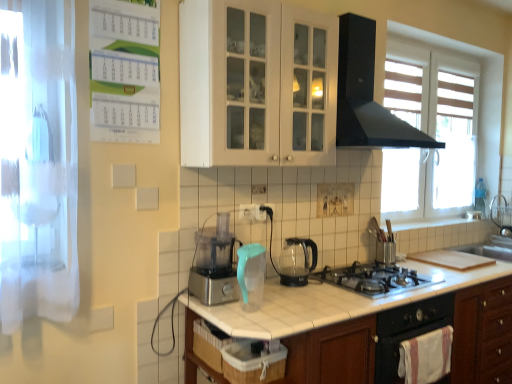
Where is `vacant space underneath transparent glass kettle at center (from a real-world perspective)`? vacant space underneath transparent glass kettle at center (from a real-world perspective) is located at coordinates (296, 282).